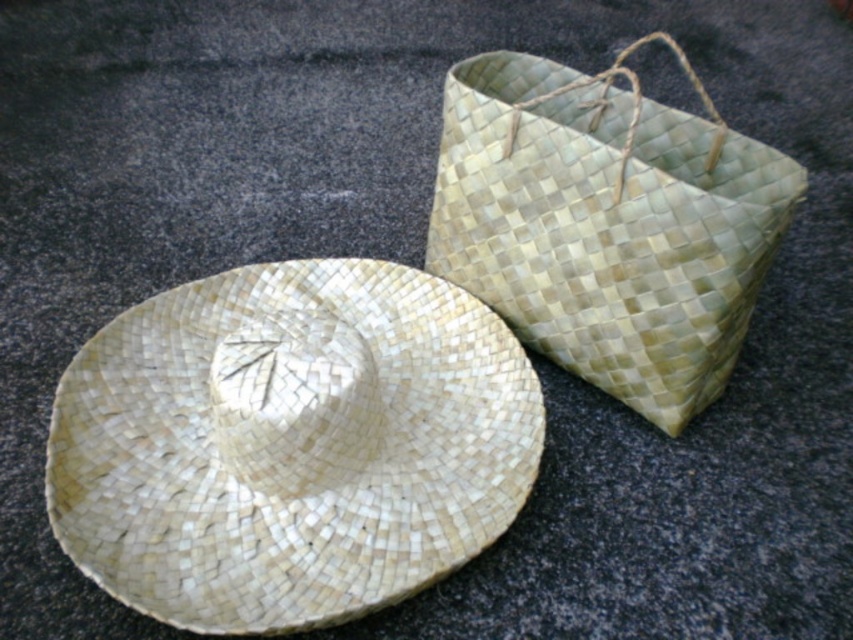
Which is behind, point (410, 371) or point (437, 273)?

Point (437, 273)

Is the position of natural woven straw hat at center less distant than that of green woven basket at upper right?

Yes, it is.

Which is behind, point (277, 276) or point (585, 326)?

The point (277, 276) is behind.

This screenshot has width=853, height=640. Find the location of `natural woven straw hat at center`. natural woven straw hat at center is located at coordinates (289, 444).